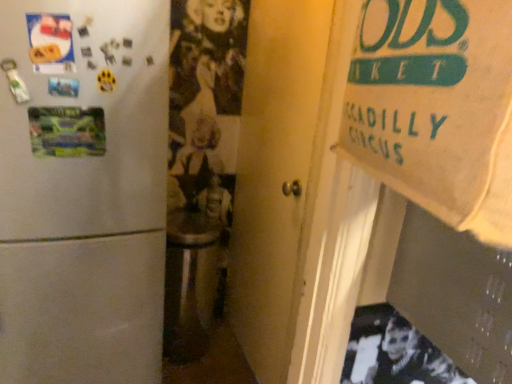
The image size is (512, 384). What do you see at coordinates (437, 108) in the screenshot? I see `beige canvas sign at upper right` at bounding box center [437, 108].

This screenshot has width=512, height=384. I want to click on beige canvas sign at upper right, so click(437, 108).

Locate an element on the screen. beige canvas sign at upper right is located at coordinates 437,108.